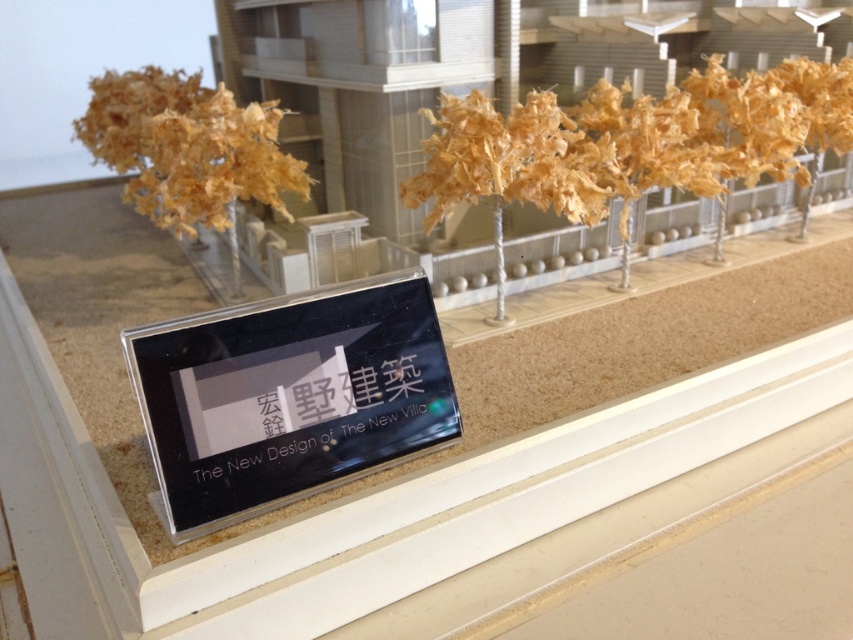
Does beige cork board at center have a greater width compared to black acrylic sign at center?

Indeed, beige cork board at center has a greater width compared to black acrylic sign at center.

Is beige cork board at center positioned in front of black acrylic sign at center?

Yes, beige cork board at center is in front of black acrylic sign at center.

Locate an element on the screen. This screenshot has height=640, width=853. beige cork board at center is located at coordinates (437, 464).

Is beige cork board at center above dry wood at left?

No, beige cork board at center is not above dry wood at left.

Which is behind, point (30, 528) or point (236, 177)?

Point (236, 177)

The width and height of the screenshot is (853, 640). Identify the location of beige cork board at center. (437, 464).

Can you confirm if beige cork board at center is smaller than light brown papier-mâché trees at upper center?

No, beige cork board at center is not smaller than light brown papier-mâché trees at upper center.

Between beige cork board at center and light brown papier-mâché trees at upper center, which one has less height?

light brown papier-mâché trees at upper center is shorter.

The width and height of the screenshot is (853, 640). Describe the element at coordinates (437, 464) in the screenshot. I see `beige cork board at center` at that location.

I want to click on beige cork board at center, so click(437, 464).